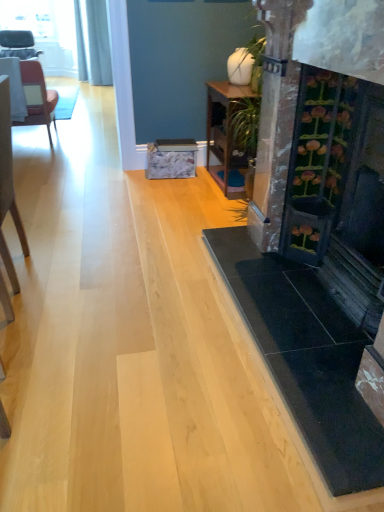
I want to click on vacant space in between dark wood fireplace at right and light brown wooden chair at left, which is the 3th chair in left-to-right order, so click(x=151, y=300).